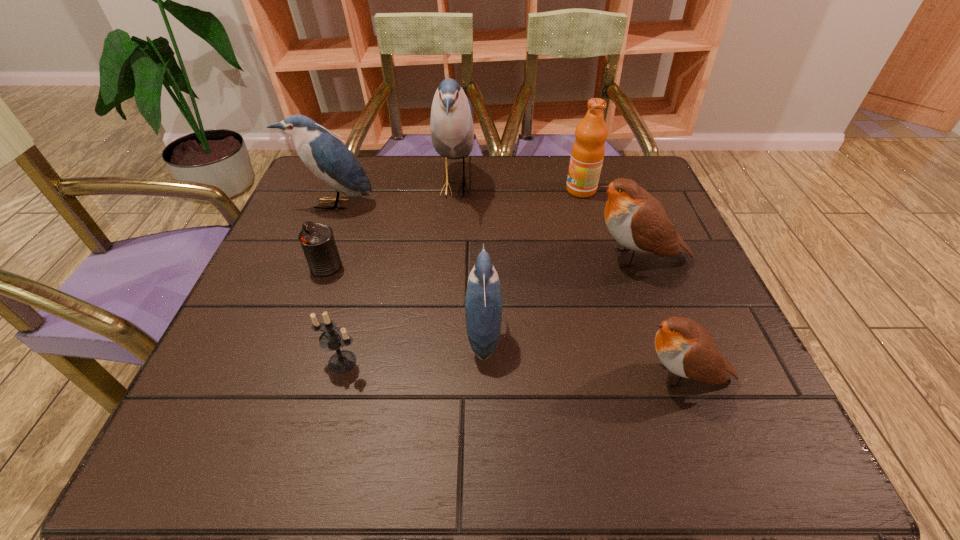
Identify which blue bird is located as the nearest to the smallest blue bird. Please provide its 2D coordinates. Your answer should be formatted as a tuple, i.e. [(x, y)], where the tuple contains the x and y coordinates of a point satisfying the conditions above.

[(451, 122)]

The height and width of the screenshot is (540, 960). In order to click on blue bird that can be found as the second closest to the second smallest blue bird in this screenshot , I will do `click(483, 302)`.

The height and width of the screenshot is (540, 960). In order to click on free space in the image that satisfies the following two spatial constraints: 1. at the tip of the tallest object's beak; 2. at the tip of the leftmost blue bird's beak in this screenshot , I will do coord(453,204).

At what (x,y) coordinates should I click in order to perform the action: click on free location that satisfies the following two spatial constraints: 1. on the label side of the fruit juice; 2. on the front side of the can. Please return your answer as a coordinate pair (x, y). Looking at the image, I should click on (603, 266).